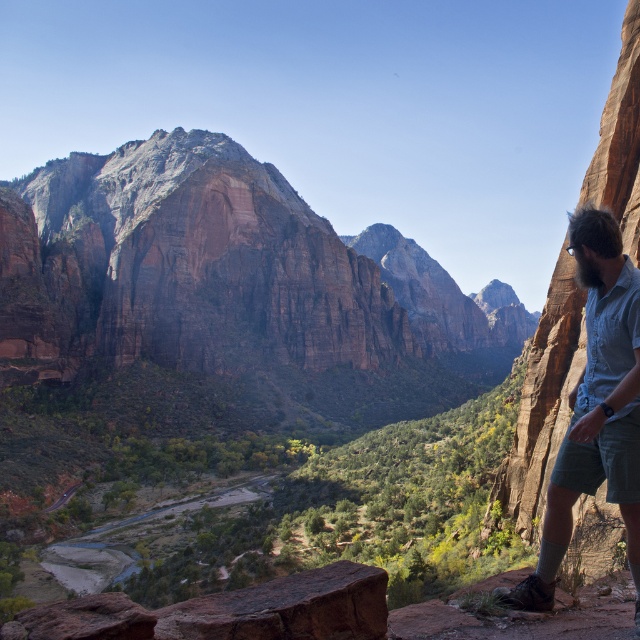
Consider the image. Does rustic stone mountain at center come behind beige textured shirt at right?

Yes, it is.

Between point (330, 355) and point (532, 596), which one is positioned behind?

The point (330, 355) is behind.

Is point (147, 241) in front of point (573, 420)?

No, (147, 241) is behind (573, 420).

The height and width of the screenshot is (640, 640). I want to click on rustic stone mountain at center, so click(x=221, y=273).

From the picture: Can you confirm if beige textured shirt at right is smaller than brown rough rock at lower center?

Incorrect, beige textured shirt at right is not smaller in size than brown rough rock at lower center.

Describe the element at coordinates (595, 406) in the screenshot. This screenshot has width=640, height=640. I see `beige textured shirt at right` at that location.

Image resolution: width=640 pixels, height=640 pixels. I want to click on beige textured shirt at right, so click(x=595, y=406).

Can you confirm if rustic stone mountain at center is thinner than brown rough rock at lower center?

No, rustic stone mountain at center is not thinner than brown rough rock at lower center.

Between point (241, 332) and point (180, 620), which one is positioned in front?

Positioned in front is point (180, 620).

The width and height of the screenshot is (640, 640). In order to click on rustic stone mountain at center in this screenshot , I will do `click(221, 273)`.